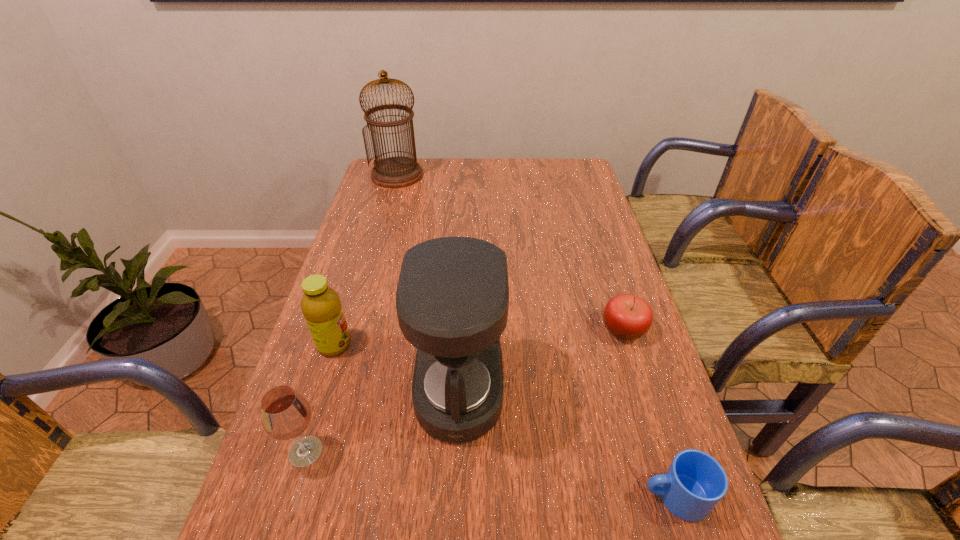
You are a GUI agent. You are given a task and a screenshot of the screen. Output one action in this format:
    pyautogui.click(x=<x>, y=<y>)
    Task: Click on the farthest object
    
    Given the screenshot: What is the action you would take?
    pos(394,172)

In order to click on the third object from right to left in this screenshot , I will do `click(452, 298)`.

Find the location of `fruit juice`. fruit juice is located at coordinates (321, 306).

Find the location of `wineglass`. wineglass is located at coordinates (285, 414).

Where is `the second shortest object`? The height and width of the screenshot is (540, 960). the second shortest object is located at coordinates (626, 316).

Find the location of a particular element. the shortest object is located at coordinates 695,482.

Locate an element on the screen. blank area located on the front-facing side of the farthest object is located at coordinates (377, 247).

This screenshot has width=960, height=540. I want to click on vacant space located on the button side of the coffee maker, so click(x=585, y=391).

Locate an element on the screen. This screenshot has width=960, height=540. vacant area situated 0.200m on the front label of the fruit juice is located at coordinates (433, 345).

Locate an element on the screen. The width and height of the screenshot is (960, 540). vacant area situated on the right of the wineglass is located at coordinates (367, 451).